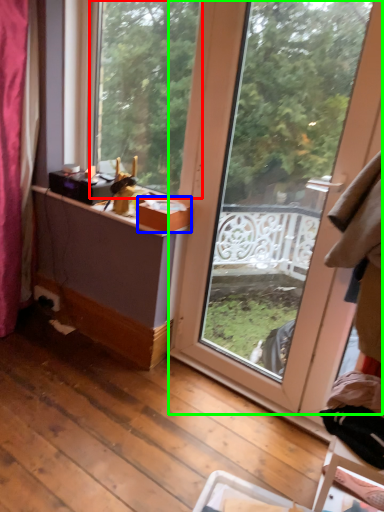
Question: Which object is positioned farthest from window (highlighted by a red box)? Select from box (highlighted by a blue box) and window (highlighted by a green box).

Choices:
 (A) box
 (B) window

Answer: (A)